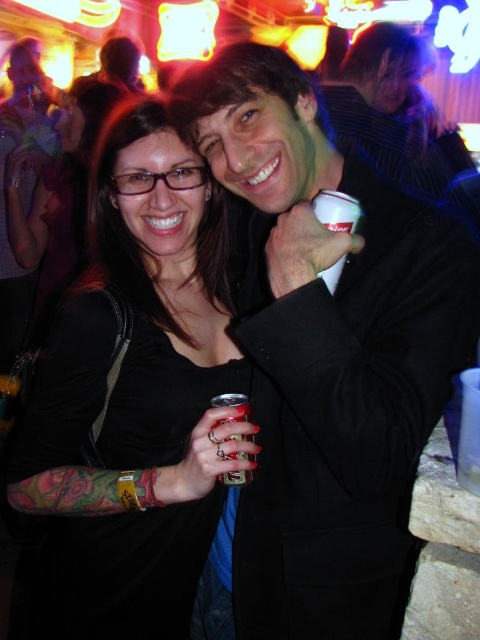
Question: In this image, where is matte black jacket at center located relative to white plastic cup at upper center?

Choices:
 (A) right
 (B) left

Answer: (B)

Question: Which object appears farthest from the camera in this image?

Choices:
 (A) metallic can at center
 (B) matte black jacket at center
 (C) matte black shirt at center

Answer: (A)

Question: Which object is the farthest from the matte black shirt at center?

Choices:
 (A) matte black jacket at center
 (B) metallic can at center

Answer: (B)

Question: Which of these objects is positioned closest to the matte black jacket at center?

Choices:
 (A) white plastic cup at upper center
 (B) matte black shirt at center

Answer: (B)

Question: Is matte black jacket at center smaller than metallic can at center?

Choices:
 (A) yes
 (B) no

Answer: (B)

Question: Is white plastic cup at upper center wider than metallic can at center?

Choices:
 (A) no
 (B) yes

Answer: (A)